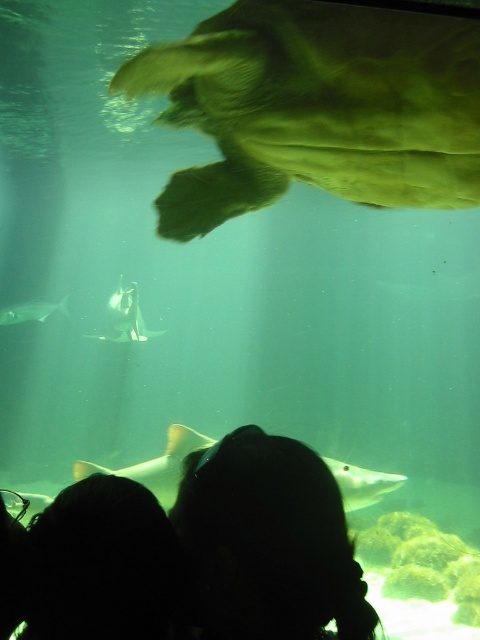
Does greenish translucent turtle at upper center appear on the right side of translucent gray shark at center?

Yes, greenish translucent turtle at upper center is to the right of translucent gray shark at center.

Which is in front, point (308, 60) or point (90, 336)?

Point (308, 60) is in front.

This screenshot has height=640, width=480. Identify the location of greenish translucent turtle at upper center. (316, 108).

Between silhouette hair at lower center and shiny silver shark at lower left, which one appears on the left side from the viewer's perspective?

Positioned to the left is shiny silver shark at lower left.

Between point (173, 520) and point (63, 310), which one is positioned in front?

Point (173, 520) is in front.

The image size is (480, 640). Describe the element at coordinates (268, 541) in the screenshot. I see `silhouette hair at lower center` at that location.

Where is `silhouette hair at lower center`? The image size is (480, 640). silhouette hair at lower center is located at coordinates (268, 541).

Can you confirm if greenish translucent turtle at upper center is positioned to the left of silhouette hair at lower left?

Incorrect, greenish translucent turtle at upper center is not on the left side of silhouette hair at lower left.

Which of these two, greenish translucent turtle at upper center or silhouette hair at lower left, stands taller?

With more height is greenish translucent turtle at upper center.

Does point (346, 128) come farther from viewer compared to point (32, 579)?

That is True.

This screenshot has height=640, width=480. Identify the location of greenish translucent turtle at upper center. (316, 108).